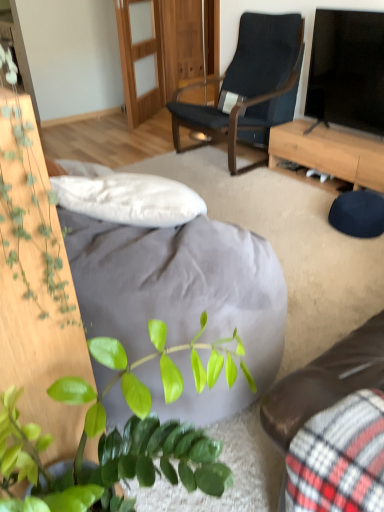
Question: Can you confirm if black glossy tv at upper right is shorter than green matte plant at lower left?

Choices:
 (A) yes
 (B) no

Answer: (B)

Question: From a real-world perspective, is black glossy tv at upper right below green matte plant at lower left?

Choices:
 (A) no
 (B) yes

Answer: (A)

Question: From the image's perspective, is black glossy tv at upper right located above green matte plant at lower left?

Choices:
 (A) yes
 (B) no

Answer: (A)

Question: Does black glossy tv at upper right appear on the left side of green matte plant at lower left?

Choices:
 (A) no
 (B) yes

Answer: (A)

Question: Does black glossy tv at upper right lie in front of green matte plant at lower left?

Choices:
 (A) no
 (B) yes

Answer: (A)

Question: Is black glossy tv at upper right thinner than green matte plant at lower left?

Choices:
 (A) yes
 (B) no

Answer: (A)

Question: Are velvet plaid studio couch at lower right and green leafy plant at left beside each other?

Choices:
 (A) yes
 (B) no

Answer: (B)

Question: Could you tell me if velvet plaid studio couch at lower right is facing green leafy plant at left?

Choices:
 (A) no
 (B) yes

Answer: (A)

Question: Is velvet plaid studio couch at lower right not inside green leafy plant at left?

Choices:
 (A) no
 (B) yes

Answer: (B)

Question: Does velvet plaid studio couch at lower right have a greater height compared to green leafy plant at left?

Choices:
 (A) yes
 (B) no

Answer: (B)

Question: Is velvet plaid studio couch at lower right behind green leafy plant at left?

Choices:
 (A) yes
 (B) no

Answer: (B)

Question: Can you confirm if velvet plaid studio couch at lower right is bigger than green leafy plant at left?

Choices:
 (A) no
 (B) yes

Answer: (B)

Question: Is velvet plaid studio couch at lower right positioned beyond the bounds of black glossy tv at upper right?

Choices:
 (A) no
 (B) yes

Answer: (B)